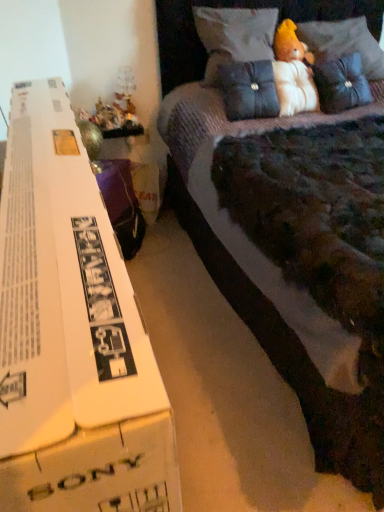
Question: Would you say velvet blue pillow at upper center, the 1th pillow in the left-to-right sequence, is outside velvet dark blue pillow at upper right, the third pillow positioned from the left?

Choices:
 (A) yes
 (B) no

Answer: (A)

Question: Is the surface of velvet blue pillow at upper center, the third pillow viewed from the right, in direct contact with velvet dark blue pillow at upper right, the third pillow positioned from the left?

Choices:
 (A) no
 (B) yes

Answer: (A)

Question: From the image's perspective, is velvet blue pillow at upper center, the third pillow viewed from the right, located beneath velvet dark blue pillow at upper right, the third pillow positioned from the left?

Choices:
 (A) yes
 (B) no

Answer: (B)

Question: Considering the relative sizes of velvet blue pillow at upper center, the 1th pillow in the left-to-right sequence, and velvet dark blue pillow at upper right, the first pillow when ordered from right to left, in the image provided, is velvet blue pillow at upper center, the 1th pillow in the left-to-right sequence, thinner than velvet dark blue pillow at upper right, the first pillow when ordered from right to left,?

Choices:
 (A) no
 (B) yes

Answer: (A)

Question: Are velvet blue pillow at upper center, the third pillow viewed from the right, and velvet dark blue pillow at upper right, the third pillow positioned from the left, located far from each other?

Choices:
 (A) yes
 (B) no

Answer: (B)

Question: From a real-world perspective, is velvet blue pillow at upper center, the third pillow viewed from the right, over velvet dark blue pillow at upper right, the third pillow positioned from the left?

Choices:
 (A) yes
 (B) no

Answer: (A)

Question: Considering the relative sizes of fluffy white teddy bear at upper right, which is counted as the first toy, starting from the right, and velvet purple bed at center in the image provided, is fluffy white teddy bear at upper right, which is counted as the first toy, starting from the right, thinner than velvet purple bed at center?

Choices:
 (A) no
 (B) yes

Answer: (B)

Question: Does fluffy white teddy bear at upper right, which is counted as the first toy, starting from the right, appear on the right side of velvet purple bed at center?

Choices:
 (A) yes
 (B) no

Answer: (B)

Question: Is fluffy white teddy bear at upper right, which is counted as the first toy, starting from the right, positioned far away from velvet purple bed at center?

Choices:
 (A) yes
 (B) no

Answer: (B)

Question: Does fluffy white teddy bear at upper right, which is counted as the first toy, starting from the right, have a greater height compared to velvet purple bed at center?

Choices:
 (A) yes
 (B) no

Answer: (B)

Question: Is fluffy white teddy bear at upper right, the second toy viewed from the left, closer to the viewer compared to velvet purple bed at center?

Choices:
 (A) no
 (B) yes

Answer: (A)

Question: Is fluffy white teddy bear at upper right, marked as the 2th toy in a bottom-to-top arrangement, smaller than velvet purple bed at center?

Choices:
 (A) yes
 (B) no

Answer: (A)

Question: Can you confirm if velvet dark blue pillow at upper right, the third pillow positioned from the left, is thinner than fluffy white teddy bear at upper right, which is counted as the first toy, starting from the right?

Choices:
 (A) yes
 (B) no

Answer: (B)